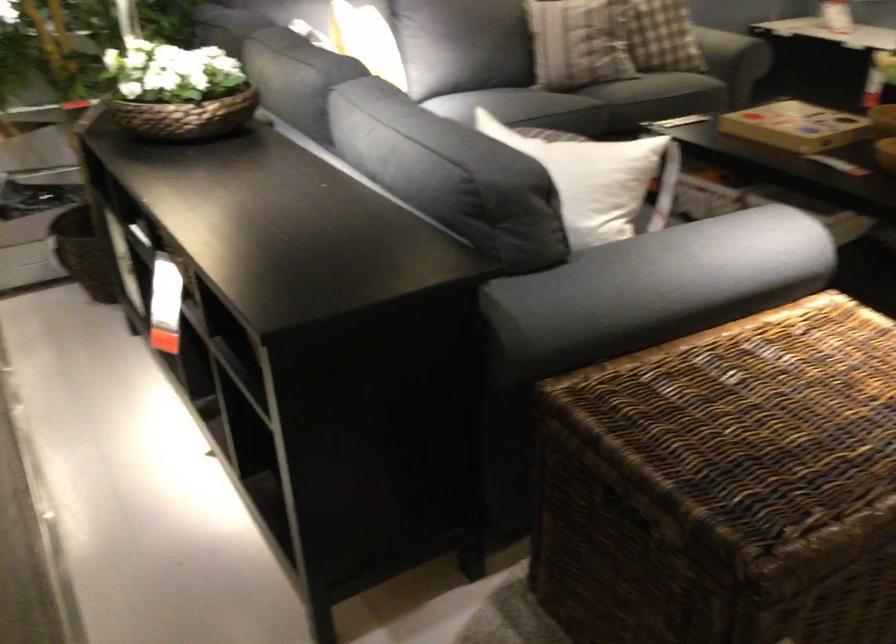
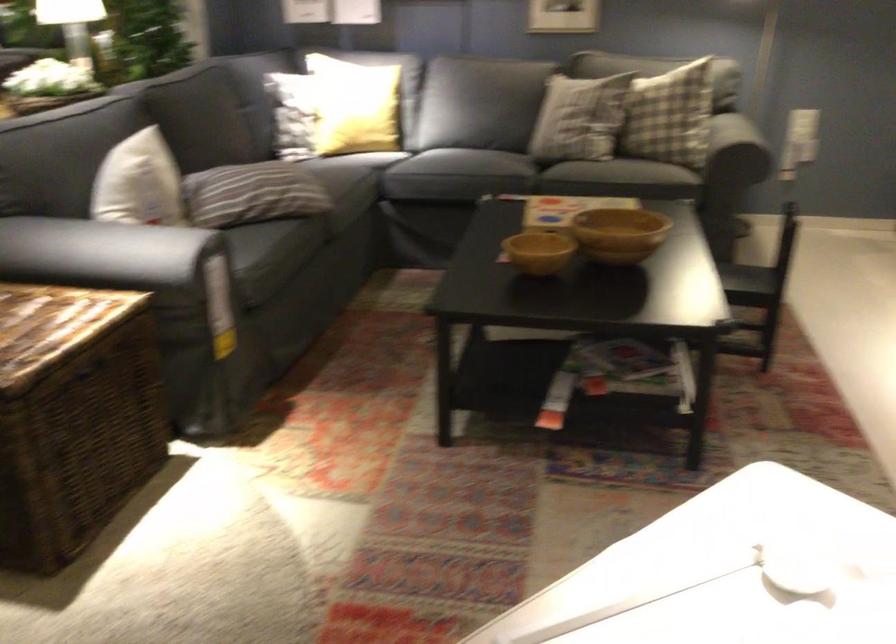
Find the pixel in the second image that matches point (702, 243) in the first image.

(117, 252)